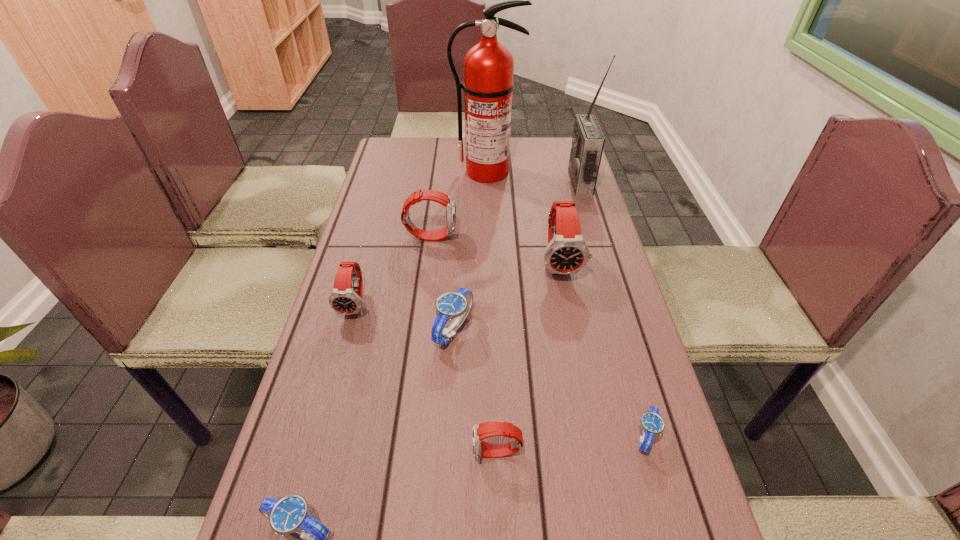
Identify which object is the seventh closest to the farthest blue watch. Please provide its 2D coordinates. Your answer should be formatted as a tuple, i.e. [(x, y)], where the tuple contains the x and y coordinates of a point satisfying the conditions above.

[(488, 85)]

This screenshot has width=960, height=540. Find the location of `watch that is the closest to the nearest object`. watch that is the closest to the nearest object is located at coordinates (484, 430).

Image resolution: width=960 pixels, height=540 pixels. I want to click on watch that is the fourth closest to the third red watch from right to left, so 484,430.

Where is `red watch that stands as the second closest to the tallest object`? The height and width of the screenshot is (540, 960). red watch that stands as the second closest to the tallest object is located at coordinates (567, 252).

Locate an element on the screen. This screenshot has width=960, height=540. red watch that is the closest to the tallest object is located at coordinates (447, 201).

Where is `blue watch that is the closest to the second nearest blue watch`? The image size is (960, 540). blue watch that is the closest to the second nearest blue watch is located at coordinates (457, 304).

Identify which blue watch is the second closest to the second tallest object. Please provide its 2D coordinates. Your answer should be formatted as a tuple, i.e. [(x, y)], where the tuple contains the x and y coordinates of a point satisfying the conditions above.

[(652, 423)]

In order to click on vacant region that satisfies the following two spatial constraints: 1. on the face of the rightmost watch; 2. on the left side of the fifth shortest object in this screenshot , I will do `click(320, 436)`.

What are the coordinates of `vacant space that satisfies the following two spatial constraints: 1. on the face of the second blue watch from right to left; 2. on the left side of the second red watch from left to right` in the screenshot? It's located at (419, 329).

This screenshot has height=540, width=960. Identify the location of blank space that satisfies the following two spatial constraints: 1. on the face of the second nearest blue watch; 2. on the left side of the sixth shortest watch. (405, 436).